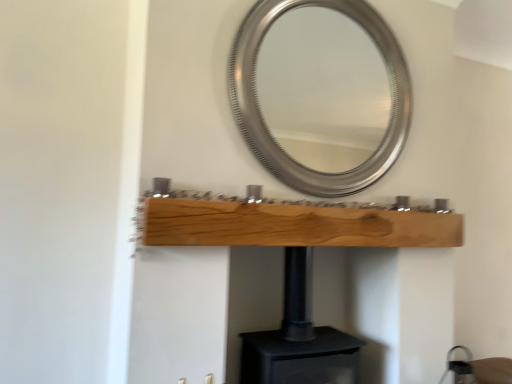
Find the location of `vacant space situated above natural wood plank at center (from a real-world perspective)`. vacant space situated above natural wood plank at center (from a real-world perspective) is located at coordinates tap(320, 205).